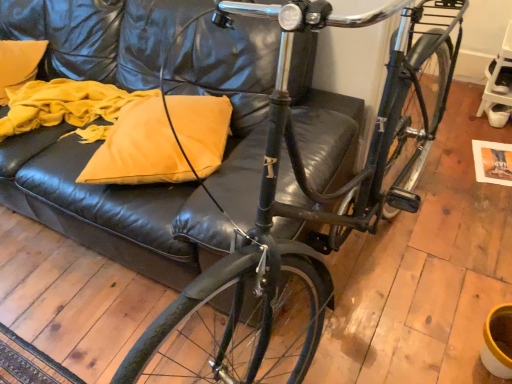
What do you see at coordinates (300, 216) in the screenshot? This screenshot has width=512, height=384. I see `shiny black bicycle at center` at bounding box center [300, 216].

Where is `shiny black bicycle at center`? shiny black bicycle at center is located at coordinates (300, 216).

What do you see at coordinates (138, 149) in the screenshot? The height and width of the screenshot is (384, 512). I see `matte yellow pillow at center` at bounding box center [138, 149].

Locate an element on the screen. This screenshot has width=512, height=384. matte yellow pillow at center is located at coordinates (138, 149).

Find the location of a particular element. This screenshot has width=512, height=384. shiny black bicycle at center is located at coordinates (300, 216).

Is shiny black bicycle at center to the right of matte yellow pillow at center from the viewer's perspective?

Correct, you'll find shiny black bicycle at center to the right of matte yellow pillow at center.

Is shiny black bicycle at center closer to camera compared to matte yellow pillow at center?

Yes.

Is point (388, 67) farther from camera compared to point (210, 163)?

That is False.

From the image's perspective, is shiny black bicycle at center beneath matte yellow pillow at center?

Yes, from the image's perspective, shiny black bicycle at center is below matte yellow pillow at center.

From a real-world perspective, is shiny black bicycle at center positioned above or below matte yellow pillow at center?

shiny black bicycle at center is situated higher than matte yellow pillow at center in the real world.

Between shiny black bicycle at center and matte yellow pillow at center, which one has smaller width?

Thinner between the two is matte yellow pillow at center.

Is shiny black bicycle at center taller than matte yellow pillow at center?

Indeed, shiny black bicycle at center has a greater height compared to matte yellow pillow at center.

Is shiny black bicycle at center smaller than matte yellow pillow at center?

Incorrect, shiny black bicycle at center is not smaller in size than matte yellow pillow at center.

Is shiny black bicycle at center completely or partially outside of matte yellow pillow at center?

Indeed, shiny black bicycle at center is completely outside matte yellow pillow at center.

Are shiny black bicycle at center and matte yellow pillow at center beside each other?

No, shiny black bicycle at center is not next to matte yellow pillow at center.

Could you tell me if shiny black bicycle at center is facing matte yellow pillow at center?

No, shiny black bicycle at center does not turn towards matte yellow pillow at center.

How many degrees apart are the facing directions of shiny black bicycle at center and matte yellow pillow at center?

The angular difference between shiny black bicycle at center and matte yellow pillow at center is 32.4 degrees.

In the image, there is a shiny black bicycle at center. Where is `pillow above it (from the image's perspective)`? The height and width of the screenshot is (384, 512). pillow above it (from the image's perspective) is located at coordinates (138, 149).

Considering the positions of objects matte yellow pillow at center and shiny black bicycle at center in the image provided, who is more to the left, matte yellow pillow at center or shiny black bicycle at center?

matte yellow pillow at center.

Is matte yellow pillow at center closer to the viewer compared to shiny black bicycle at center?

No, it is not.

Is point (180, 173) more distant than point (276, 103)?

Yes, point (180, 173) is behind point (276, 103).

From the image's perspective, which one is positioned higher, matte yellow pillow at center or shiny black bicycle at center?

matte yellow pillow at center appears higher in the image.

From a real-world perspective, is matte yellow pillow at center above or below shiny black bicycle at center?

matte yellow pillow at center is below shiny black bicycle at center.

In terms of width, does matte yellow pillow at center look wider or thinner when compared to shiny black bicycle at center?

In the image, matte yellow pillow at center appears to be more narrow than shiny black bicycle at center.

Considering the sizes of objects matte yellow pillow at center and shiny black bicycle at center in the image provided, who is taller, matte yellow pillow at center or shiny black bicycle at center?

shiny black bicycle at center.

In the scene shown: Can you confirm if matte yellow pillow at center is smaller than shiny black bicycle at center?

Yes, matte yellow pillow at center is smaller than shiny black bicycle at center.

Looking at this image, is shiny black bicycle at center surrounded by matte yellow pillow at center?

No, shiny black bicycle at center is not inside matte yellow pillow at center.

Would you consider matte yellow pillow at center to be distant from shiny black bicycle at center?

That's not correct — matte yellow pillow at center is a little close to shiny black bicycle at center.

Is shiny black bicycle at center at the back of matte yellow pillow at center?

No.

How much distance is there between matte yellow pillow at center and shiny black bicycle at center?

They are 17.33 inches apart.

At what (x,y) coordinates should I click in order to perform the action: click on pillow to the left of shiny black bicycle at center. Please return your answer as a coordinate pair (x, y). Looking at the image, I should click on (138, 149).

The image size is (512, 384). In order to click on pillow located above the shiny black bicycle at center (from the image's perspective) in this screenshot , I will do `click(138, 149)`.

In the image, there is a matte yellow pillow at center. Identify the location of bicycle below it (from the image's perspective). (300, 216).